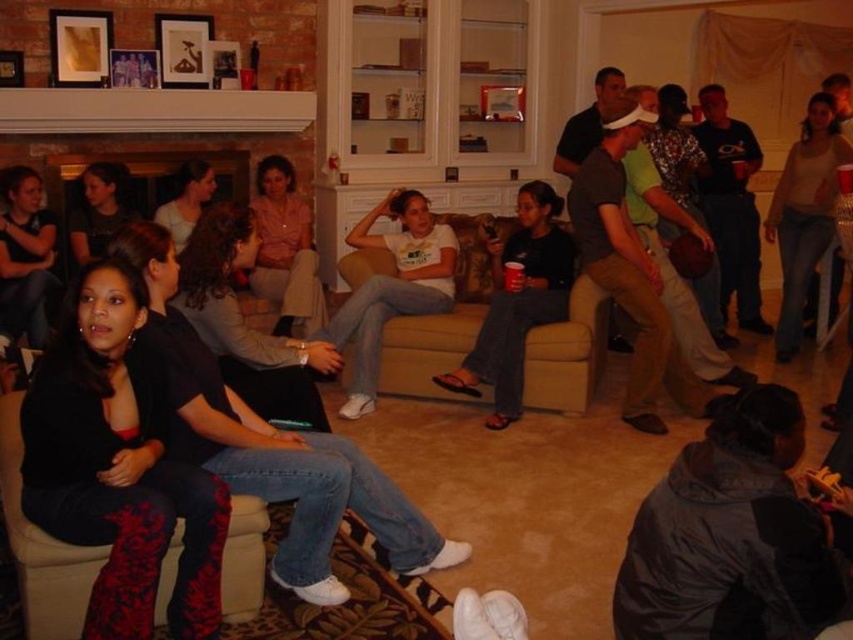
You are standing in the living room and want to take a photo of both the point at coordinates point (x=389, y=198) and point (x=193, y=161). Which point should you focus on first to ensure both are in focus?

You should focus on point (x=389, y=198) first because it is closer to the camera than point (x=193, y=161), ensuring both points are within the depth of field.

You are a photographer standing at the camera position. You want to take a closeup shot of the dark gray fabric pants at center. Considering the distance between you and the pants, is it possible to capture a clear closeup without moving closer?

The distance between the dark gray fabric pants at center and the camera is 13.30 feet. Since this distance is quite far, capturing a clear closeup without moving closer may be challenging unless using a zoom lens capable of magnifying the subject sufficiently.